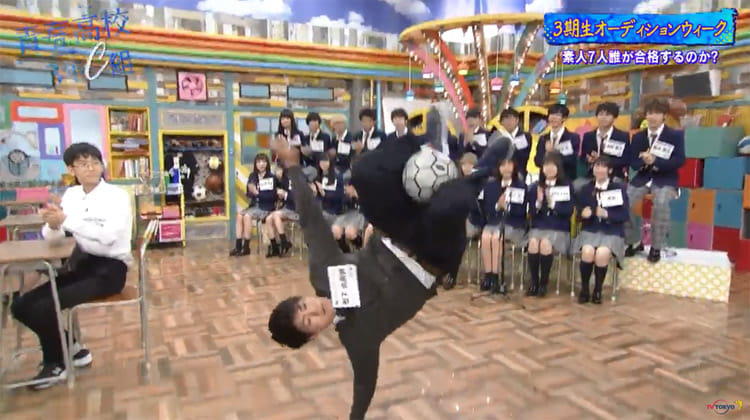
Locate an element on the screen. The width and height of the screenshot is (750, 420). wall is located at coordinates (208, 118), (736, 135).